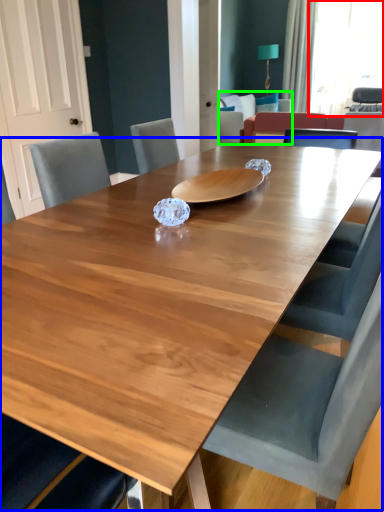
Question: Which object is positioned farthest from window screen (highlighted by a red box)? Select from table (highlighted by a blue box) and armchair (highlighted by a green box).

Choices:
 (A) table
 (B) armchair

Answer: (A)